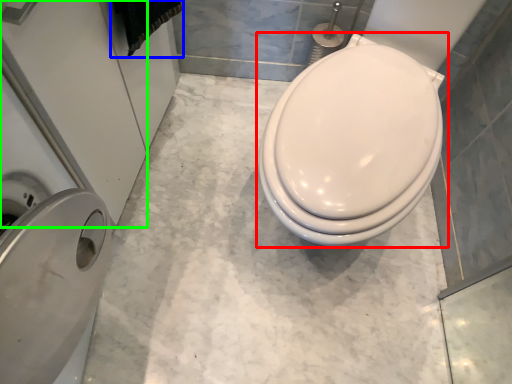
Question: Which is farther away from toilet (highlighted by a red box)? material (highlighted by a blue box) or screen door (highlighted by a green box)?

Choices:
 (A) material
 (B) screen door

Answer: (B)